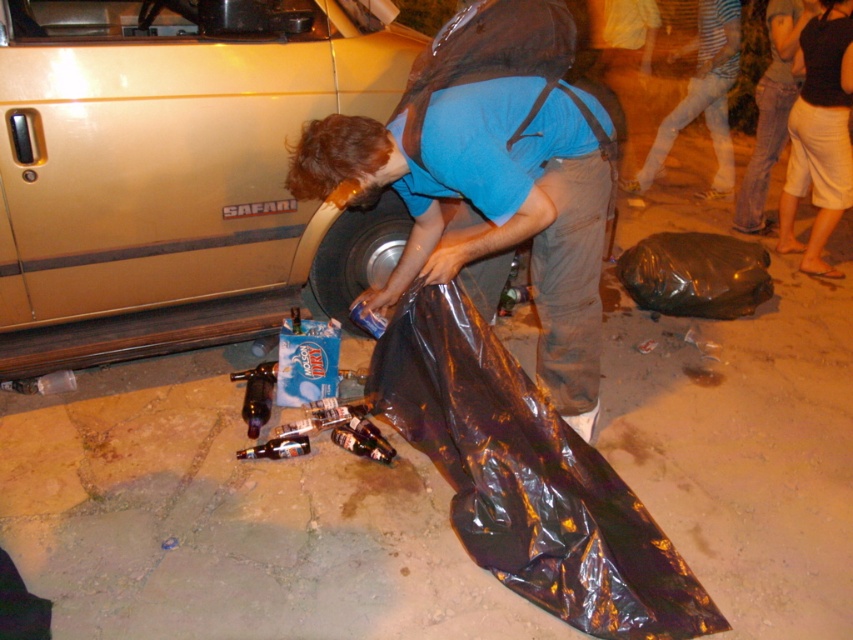
You are a person who wants to pick up the striped cotton shirt at lower right and the white cotton shorts at lower right. If you are standing at the center of the image, which item is closer to you?

The white cotton shorts at lower right is 3.72 feet from striped cotton shirt at lower right. Since you are standing at the center of the image, the white cotton shorts at lower right is closer to you than the striped cotton shirt at lower right.

You are standing at the origin of a coordinate system placed at the bottom left corner of the image. You see a point at coordinates point (819, 134). What object is this point located on?

The point (819, 134) is located on white cotton shorts at lower right.

You are standing in the scene and want to pick up an object located at point [335,156] and another at point [711,35]. Which point will require you to move forward more to reach it?

Point [711,35] will require moving forward more because it is farther from the camera compared to point [335,156].